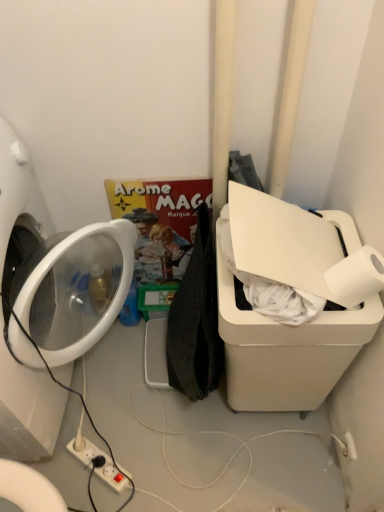
At what (x,y) coordinates should I click in order to perform the action: click on empty space that is ontop of white plastic water cooler at right (from a real-world perspective). Please return your answer as a coordinate pair (x, y). This screenshot has height=512, width=384. Looking at the image, I should click on (307, 262).